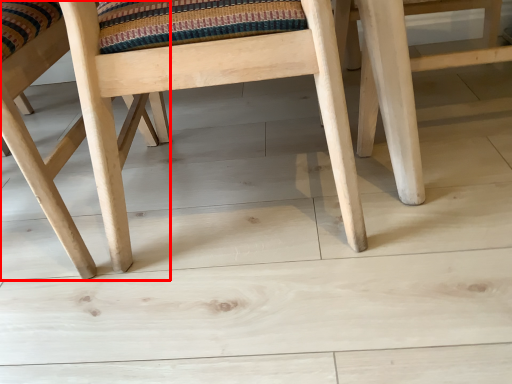
Question: From the image, what is the correct spatial relationship of chair (annotated by the red box) in relation to chair?

Choices:
 (A) left
 (B) right

Answer: (A)